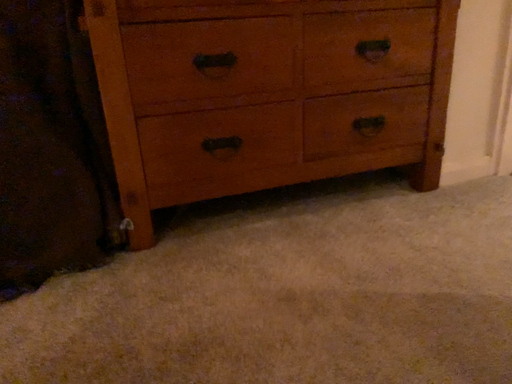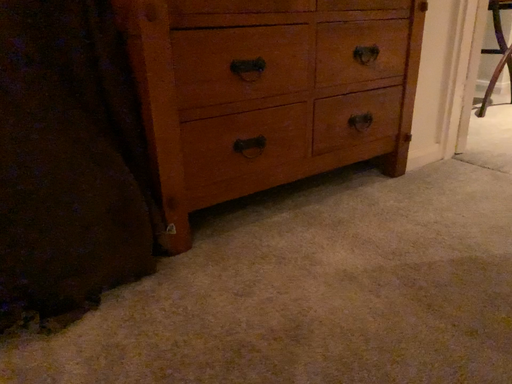
Question: How did the camera likely rotate when shooting the video?

Choices:
 (A) rotated right
 (B) rotated left

Answer: (A)